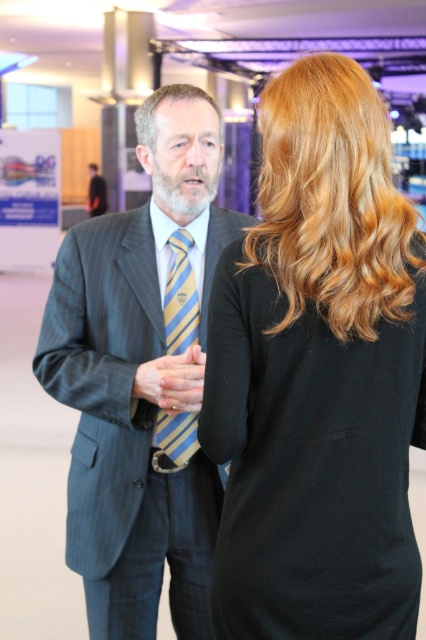
Who is taller, smooth black dress at center or yellow striped tie at center?

With more height is smooth black dress at center.

Identify the location of smooth black dress at center. This screenshot has width=426, height=640. (319, 374).

Which is below, pinstriped suit at center or yellow striped tie at center?

pinstriped suit at center is lower down.

Who is shorter, pinstriped suit at center or yellow striped tie at center?

With less height is yellow striped tie at center.

Describe the element at coordinates (141, 378) in the screenshot. I see `pinstriped suit at center` at that location.

You are a GUI agent. You are given a task and a screenshot of the screen. Output one action in this format:
    pyautogui.click(x=<x>, y=<y>)
    Task: Click on the pinstriped suit at center
    This screenshot has width=426, height=640.
    Given the screenshot: What is the action you would take?
    pyautogui.click(x=141, y=378)

Which of these two, smooth black dress at center or pinstriped suit at center, stands shorter?

smooth black dress at center

Who is higher up, smooth black dress at center or pinstriped suit at center?

smooth black dress at center is higher up.

You are a GUI agent. You are given a task and a screenshot of the screen. Output one action in this format:
    pyautogui.click(x=<x>, y=<y>)
    Task: Click on the smooth black dress at center
    The image size is (426, 640).
    Given the screenshot: What is the action you would take?
    pyautogui.click(x=319, y=374)